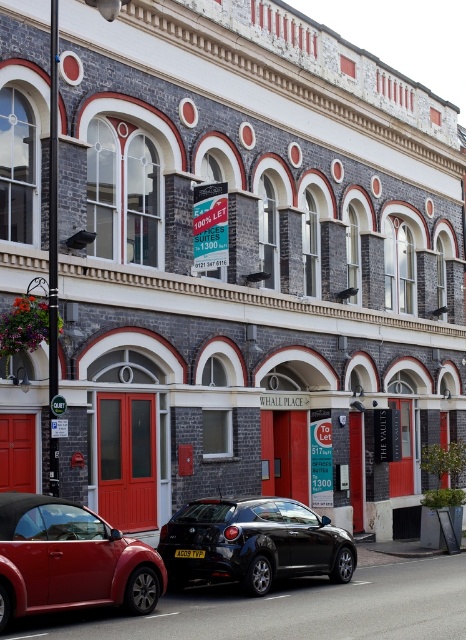
Question: Which object appears farthest from the camera in this image?

Choices:
 (A) shiny red convertible at lower left
 (B) shiny black hatchback at center

Answer: (B)

Question: Does shiny red convertible at lower left have a smaller size compared to shiny black hatchback at center?

Choices:
 (A) no
 (B) yes

Answer: (B)

Question: Which of the following is the closest to the observer?

Choices:
 (A) (191, 513)
 (B) (142, 595)

Answer: (B)

Question: Where is shiny red convertible at lower left located in relation to shiny black hatchback at center in the image?

Choices:
 (A) above
 (B) below

Answer: (A)

Question: Is shiny red convertible at lower left to the left of shiny black hatchback at center from the viewer's perspective?

Choices:
 (A) yes
 (B) no

Answer: (A)

Question: Which object appears farthest from the camera in this image?

Choices:
 (A) shiny red convertible at lower left
 (B) shiny black hatchback at center

Answer: (B)